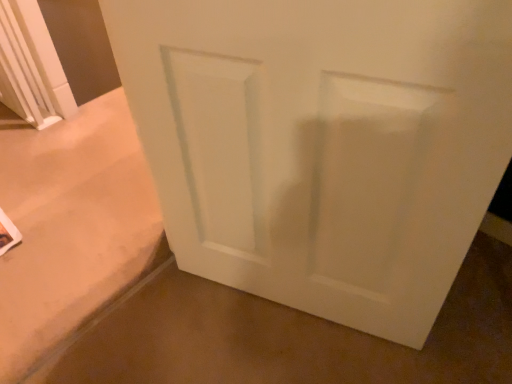
Question: Is white matte door at center bigger than white smooth door at center?

Choices:
 (A) yes
 (B) no

Answer: (A)

Question: Is white matte door at center smaller than white smooth door at center?

Choices:
 (A) yes
 (B) no

Answer: (B)

Question: Does white matte door at center have a greater height compared to white smooth door at center?

Choices:
 (A) no
 (B) yes

Answer: (B)

Question: From a real-world perspective, is white matte door at center physically below white smooth door at center?

Choices:
 (A) yes
 (B) no

Answer: (B)

Question: Is white matte door at center oriented away from white smooth door at center?

Choices:
 (A) yes
 (B) no

Answer: (B)

Question: From a real-world perspective, is white matte door at center on top of white smooth door at center?

Choices:
 (A) yes
 (B) no

Answer: (A)

Question: Is white smooth door at center at the left side of white matte door at center?

Choices:
 (A) no
 (B) yes

Answer: (A)

Question: Does white smooth door at center come in front of white matte door at center?

Choices:
 (A) yes
 (B) no

Answer: (B)

Question: Does white smooth door at center have a smaller size compared to white matte door at center?

Choices:
 (A) yes
 (B) no

Answer: (A)

Question: Is white matte door at center at the back of white smooth door at center?

Choices:
 (A) no
 (B) yes

Answer: (A)

Question: Is white smooth door at center oriented towards white matte door at center?

Choices:
 (A) yes
 (B) no

Answer: (B)

Question: Can you confirm if white smooth door at center is taller than white matte door at center?

Choices:
 (A) yes
 (B) no

Answer: (B)

Question: From a real-world perspective, relative to white smooth door at center, is white matte door at center vertically above or below?

Choices:
 (A) below
 (B) above

Answer: (B)